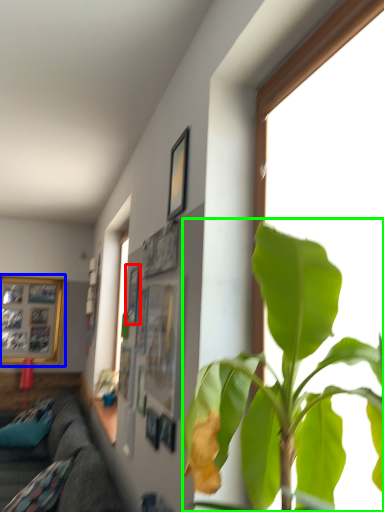
Question: Which is farther away from picture frame (highlighted by a red box)? picture frame (highlighted by a blue box) or houseplant (highlighted by a green box)?

Choices:
 (A) picture frame
 (B) houseplant

Answer: (A)